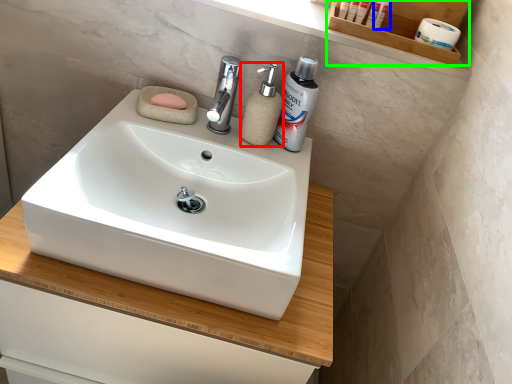
Question: Based on their relative distances, which object is farther from soap dispenser (highlighted by a red box)? Choose from cosmetic (highlighted by a blue box) and shelf (highlighted by a green box).

Choices:
 (A) cosmetic
 (B) shelf

Answer: (A)